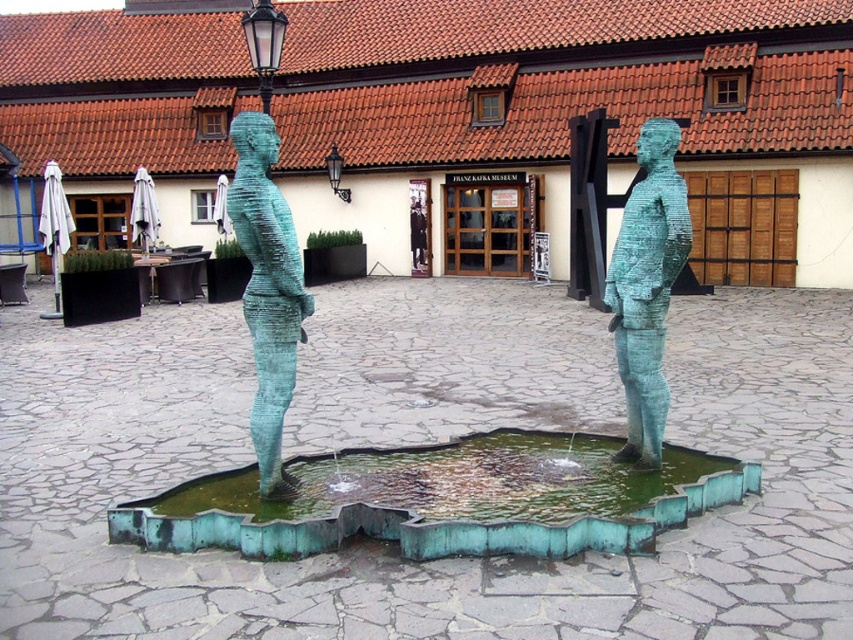
You are an art student analyzing the sculptures in the square. You notice two statues labeled as green patina statue at center and green patinated bronze statue at center. Which one is wider?

The green patina statue at center is wider than the green patinated bronze statue at center according to the description.

What does the point at coordinates (647, 285) indicate in the image?

The point at coordinates (647, 285) marks the green patina statue at center.